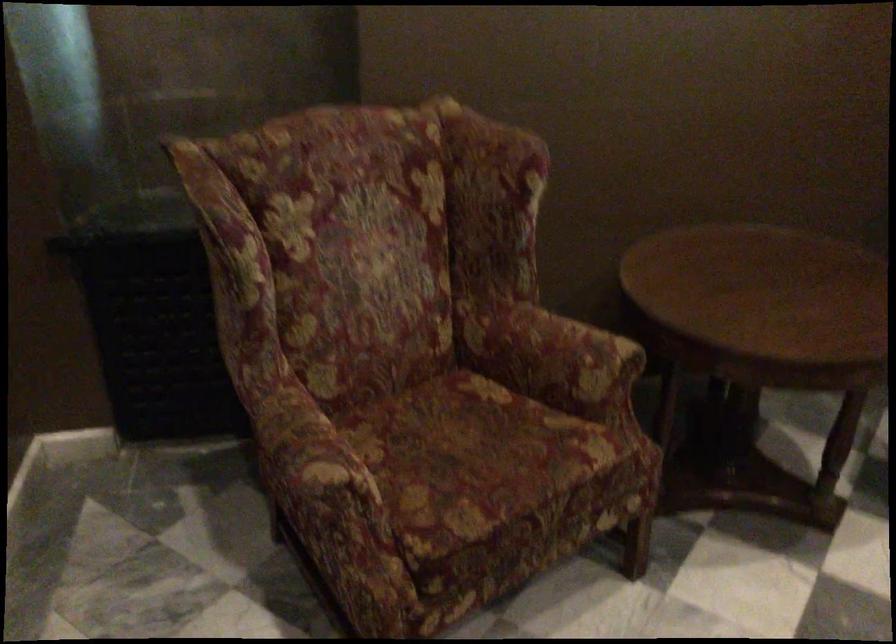
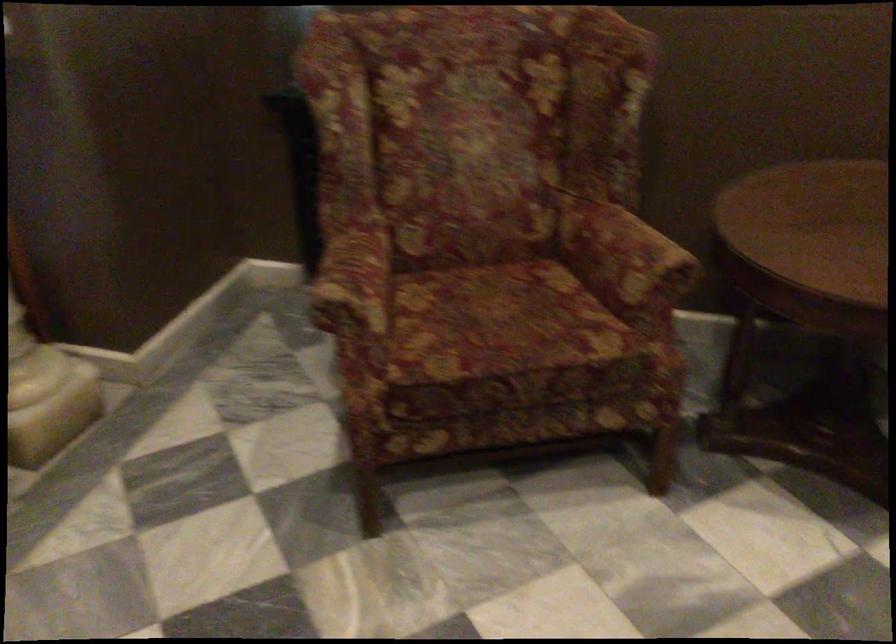
Where in the second image is the point corresponding to pixel 478 455 from the first image?

(501, 323)